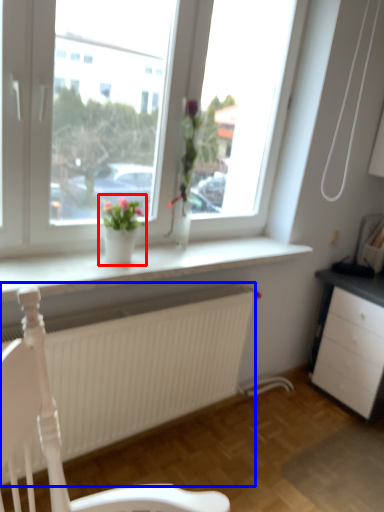
Question: Which point is closer to the camera, houseplant (highlighted by a red box) or carpets (highlighted by a blue box)?

Choices:
 (A) houseplant
 (B) carpets

Answer: (B)